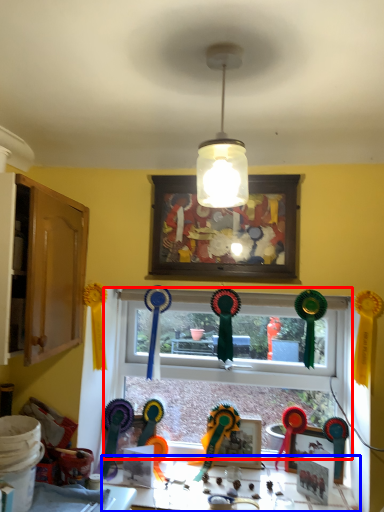
Question: Which object appears closest to the camera in this image, window (highlighted by a red box) or table (highlighted by a blue box)?

Choices:
 (A) window
 (B) table

Answer: (B)